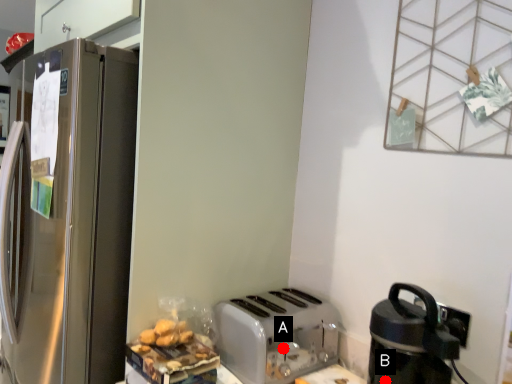
Question: Two points are circled on the image, labeled by A and B beside each circle. Which point is closer to the camera?

Choices:
 (A) A is closer
 (B) B is closer

Answer: (B)